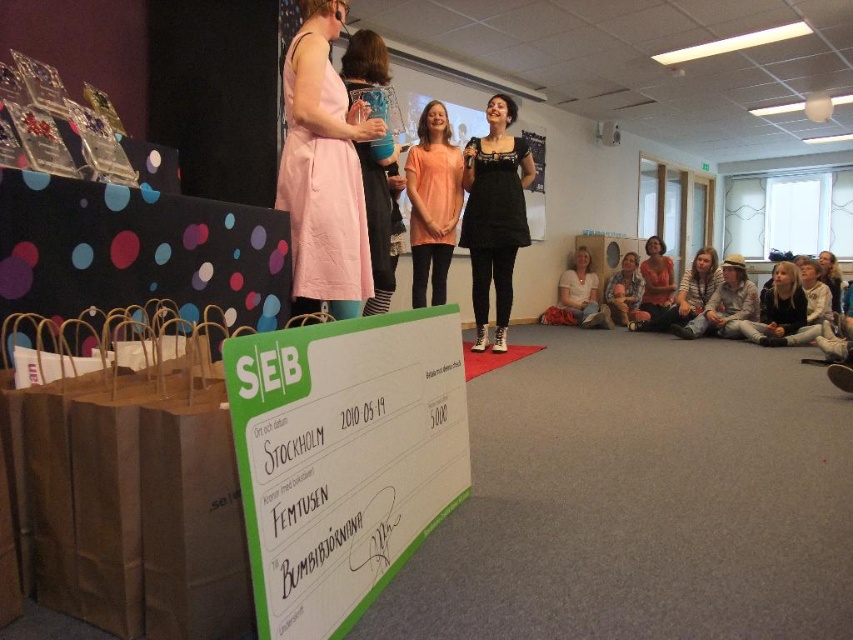
You are standing at the entrance of the conference hall and want to take a photo of the black matte dress at center. If the camera you are using has a standard field of view, which direction should you face to ensure the dress is in the center of your photo?

Since the black matte dress at center is located at point [494,216], you should aim your camera slightly to the left and downward to center the dress in your photo.

You are a stagehand standing at the back of the stage. You need to hand a prop to the person wearing the black matte dress at center without disturbing the ongoing presentation. The prop is placed on the green paper sign at center. Can you reach it from your current position?

The distance between the green paper sign at center and the black matte dress at center is 3.02 meters. Since you are at the back of the stage, you would need to move forward to retrieve the prop from the green paper sign at center and then hand it to the person in the black matte dress at center, as the distance is too far to reach directly.